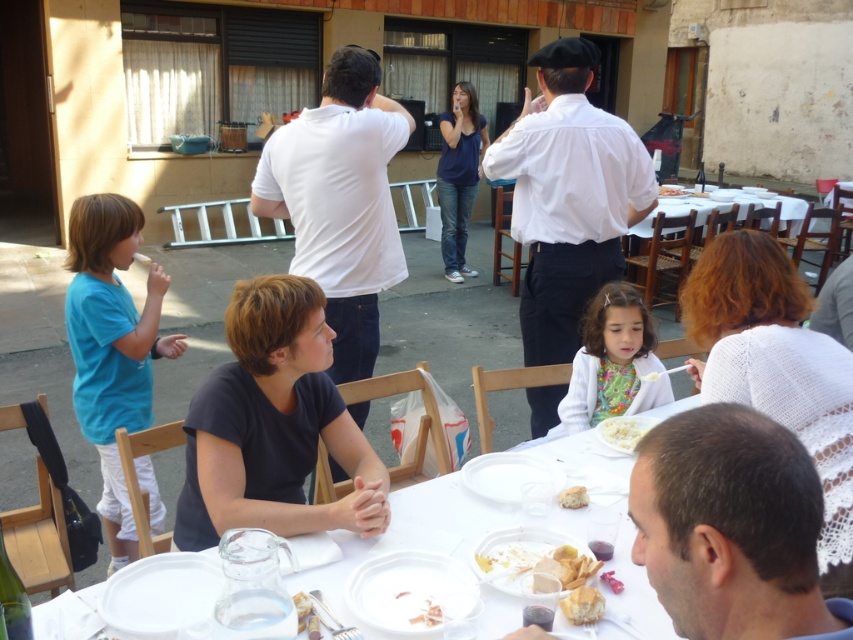
Does point (590, 429) come farther from viewer compared to point (601, 612)?

That is True.

Does white plastic table at center appear under white crumbly bread at lower center?

Actually, white plastic table at center is above white crumbly bread at lower center.

Does point (659, 628) come behind point (577, 588)?

No.

Find the location of a particular element. white plastic table at center is located at coordinates (413, 534).

From the picture: How much distance is there between blue cotton shirt at left and white crumbly bread at lower center?

blue cotton shirt at left is 6.51 feet away from white crumbly bread at lower center.

Image resolution: width=853 pixels, height=640 pixels. Identify the location of blue cotton shirt at left. (112, 346).

Who is shorter, dark brown hair at lower right or white cotton shirt at upper center?

dark brown hair at lower right is shorter.

Which is more to the right, dark brown hair at lower right or white cotton shirt at upper center?

white cotton shirt at upper center

Measure the distance between point [804,465] and camera.

The distance of point [804,465] from camera is 36.65 inches.

This screenshot has width=853, height=640. Find the location of `dark brown hair at lower right`. dark brown hair at lower right is located at coordinates (730, 525).